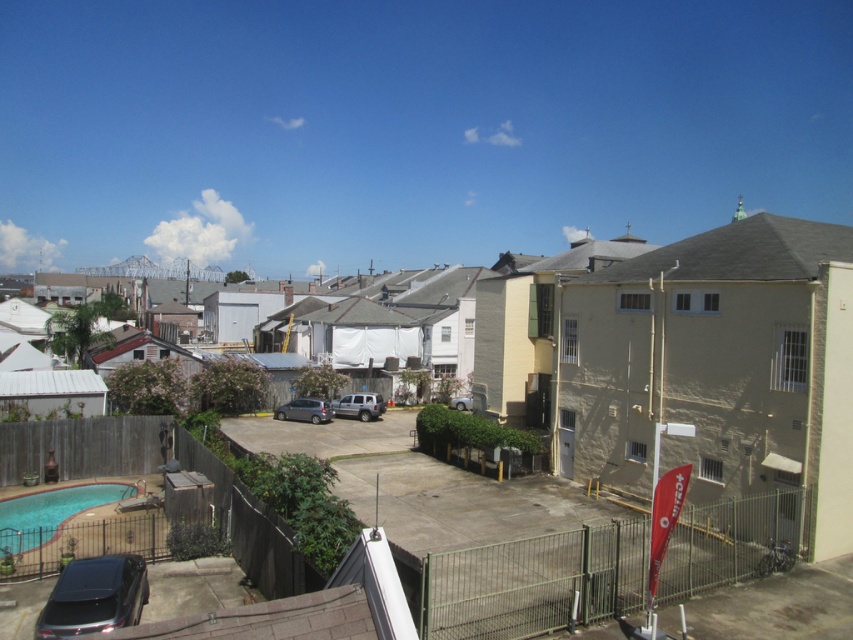
Is shiny black suv at lower left positioned before blue smooth pool at lower left?

That is True.

Which of these two, shiny black suv at lower left or blue smooth pool at lower left, stands taller?

shiny black suv at lower left

Which is in front, point (109, 604) or point (106, 493)?

Point (109, 604) is more forward.

The image size is (853, 640). I want to click on shiny black suv at lower left, so (x=94, y=596).

Which is in front, point (74, 621) or point (360, 397)?

Positioned in front is point (74, 621).

Is shiny black suv at lower left taller than matte silver suv at center?

Incorrect, shiny black suv at lower left's height is not larger of matte silver suv at center's.

Is point (97, 573) closer to viewer compared to point (372, 396)?

Yes, it is in front of point (372, 396).

Locate an element on the screen. shiny black suv at lower left is located at coordinates (94, 596).

Looking at this image, is blue smooth pool at lower left positioned before matte silver suv at center?

That is True.

Does blue smooth pool at lower left appear under matte silver suv at center?

Correct, blue smooth pool at lower left is located below matte silver suv at center.

Does point (56, 502) come in front of point (347, 396)?

That is True.

You are a GUI agent. You are given a task and a screenshot of the screen. Output one action in this format:
    pyautogui.click(x=<x>, y=<y>)
    Task: Click on the blue smooth pool at lower left
    Image resolution: width=853 pixels, height=640 pixels.
    Given the screenshot: What is the action you would take?
    tap(50, 509)